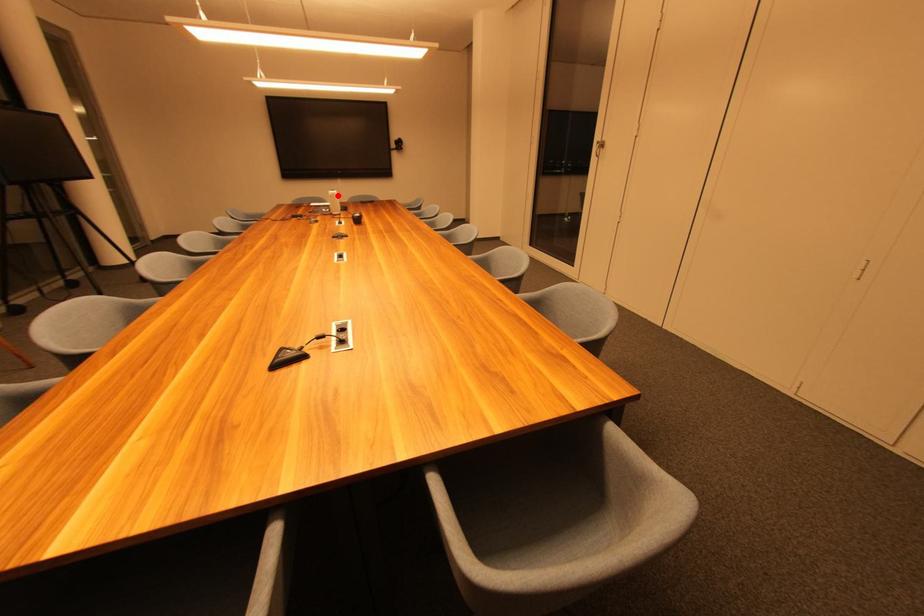
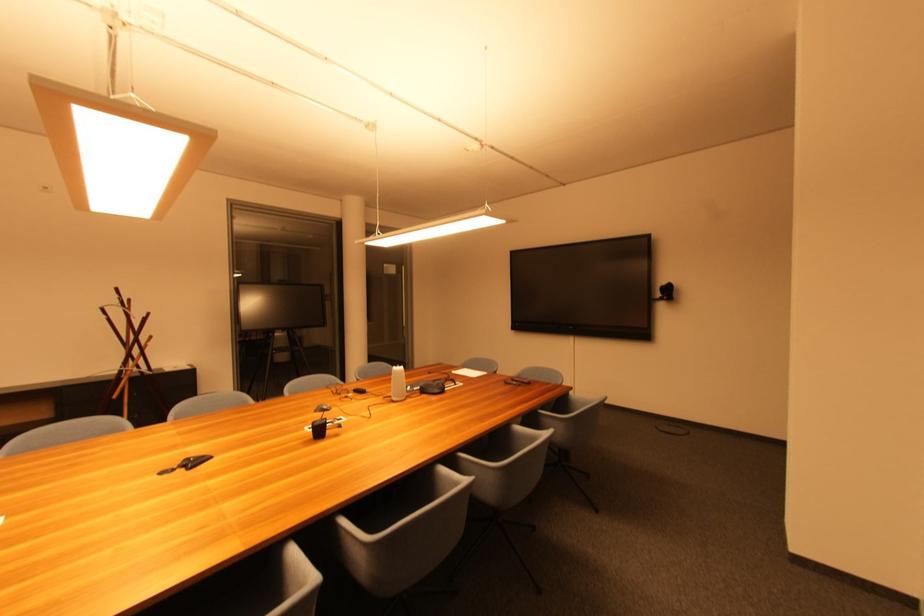
Question: I am providing you with two images of the same scene from different viewpoints. A red point is shown in image1. For the corresponding object point in image2, is it positioned nearer or farther from the camera?

Choices:
 (A) Nearer
 (B) Farther

Answer: (A)